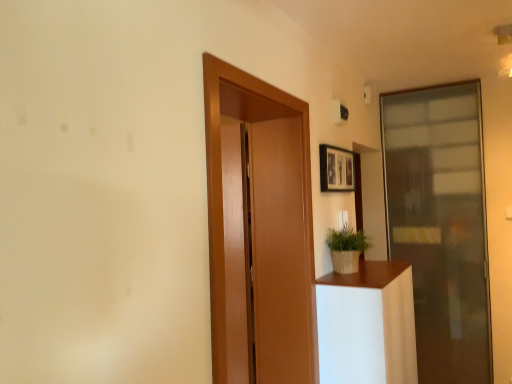
Consider the image. How much space does transparent glass door at right, marked as the 1th door in a right-to-left arrangement, occupy vertically?

transparent glass door at right, marked as the 1th door in a right-to-left arrangement, is 7.76 feet tall.

Where is `white matte plant pot at right`? This screenshot has width=512, height=384. white matte plant pot at right is located at coordinates (367, 325).

You are a GUI agent. You are given a task and a screenshot of the screen. Output one action in this format:
    pyautogui.click(x=<x>, y=<y>)
    Task: Click on the wooden framed picture at upper right
    Image resolution: width=512 pixels, height=384 pixels.
    Given the screenshot: What is the action you would take?
    pyautogui.click(x=336, y=169)

Find the location of a particular element. wooden door at center, the second door from the back is located at coordinates (265, 225).

From a real-world perspective, which object rests below the other?

white matte plant pot at right is physically lower.

Which of these two, green woven basket at right or white matte plant pot at right, is smaller?

green woven basket at right is smaller.

Is green woven basket at right in front of white matte plant pot at right?

No, green woven basket at right is behind white matte plant pot at right.

Is point (291, 125) behind point (424, 244)?

No, (291, 125) is closer to viewer.

From a real-world perspective, who is located lower, wooden door at center, which appears as the 1th door when viewed from the left, or transparent glass door at right, which is the first door from back to front?

transparent glass door at right, which is the first door from back to front.

How far apart are wooden door at center, the second door from the back, and transparent glass door at right, the 2th door positioned from the left?

The distance of wooden door at center, the second door from the back, from transparent glass door at right, the 2th door positioned from the left, is 1.78 meters.

Is white matte plant pot at right turned away from wooden door at center, arranged as the second door when viewed from the right?

No.

Is point (371, 381) less distant than point (216, 326)?

No, (371, 381) is behind (216, 326).

From the image's perspective, is white matte plant pot at right below wooden door at center, the 1th door from the front?

Yes, from the image's perspective, white matte plant pot at right is beneath wooden door at center, the 1th door from the front.

The width and height of the screenshot is (512, 384). Identify the location of picture frame that appears behind the wooden door at center, the 1th door from the front. click(x=336, y=169).

Relative to wooden door at center, which appears as the 1th door when viewed from the left, is wooden framed picture at upper right in front or behind?

Clearly, wooden framed picture at upper right is behind wooden door at center, which appears as the 1th door when viewed from the left.

From the picture: Is wooden framed picture at upper right placed right next to wooden door at center, the second door from the back?

wooden framed picture at upper right is not next to wooden door at center, the second door from the back, and they're not touching.

Is wooden framed picture at upper right looking in the opposite direction of wooden door at center, arranged as the second door when viewed from the right?

No, wooden framed picture at upper right is not facing away from wooden door at center, arranged as the second door when viewed from the right.

Is point (350, 184) farther from camera compared to point (472, 85)?

No.

Between wooden framed picture at upper right and transparent glass door at right, the 2th door positioned from the left, which one has less height?

Standing shorter between the two is wooden framed picture at upper right.

Visually, is wooden framed picture at upper right positioned to the left or to the right of transparent glass door at right, the 2th door positioned from the left?

wooden framed picture at upper right is to the left of transparent glass door at right, the 2th door positioned from the left.

How different are the orientations of wooden framed picture at upper right and transparent glass door at right, which is the second door from front to back, in degrees?

90.1 degrees separate the facing orientations of wooden framed picture at upper right and transparent glass door at right, which is the second door from front to back.

Which is in front, wooden framed picture at upper right or white matte plant pot at right?

white matte plant pot at right is in front.

Is wooden framed picture at upper right looking in the opposite direction of white matte plant pot at right?

No, wooden framed picture at upper right's orientation is not away from white matte plant pot at right.

Can you confirm if wooden framed picture at upper right is positioned to the left of white matte plant pot at right?

Yes, wooden framed picture at upper right is to the left of white matte plant pot at right.

Is wooden door at center, arranged as the second door when viewed from the right, at the back of transparent glass door at right, which is the second door from front to back?

No, transparent glass door at right, which is the second door from front to back, is not facing away from wooden door at center, arranged as the second door when viewed from the right.

The width and height of the screenshot is (512, 384). I want to click on door in front of the transparent glass door at right, the 2th door positioned from the left, so click(x=265, y=225).

Is transparent glass door at right, which is the first door from back to front, to the left of wooden door at center, the second door from the back, from the viewer's perspective?

Incorrect, transparent glass door at right, which is the first door from back to front, is not on the left side of wooden door at center, the second door from the back.

Looking at this image, is transparent glass door at right, the 2th door positioned from the left, placed right next to wooden door at center, the second door from the back?

transparent glass door at right, the 2th door positioned from the left, is not next to wooden door at center, the second door from the back, and they're not touching.

This screenshot has width=512, height=384. I want to click on houseplant above the white matte plant pot at right (from the image's perspective), so click(346, 249).

Identify the location of door on the left of transparent glass door at right, which is the first door from back to front. The height and width of the screenshot is (384, 512). (265, 225).

Considering their positions, is wooden framed picture at upper right positioned further to white matte plant pot at right than transparent glass door at right, marked as the 1th door in a right-to-left arrangement?

Among the two, transparent glass door at right, marked as the 1th door in a right-to-left arrangement, is located further to white matte plant pot at right.

Based on their spatial positions, is green woven basket at right or wooden door at center, the 1th door from the front, further from transparent glass door at right, marked as the 1th door in a right-to-left arrangement?

The object further to transparent glass door at right, marked as the 1th door in a right-to-left arrangement, is wooden door at center, the 1th door from the front.

Looking at the image, which one is located further to transparent glass door at right, marked as the 1th door in a right-to-left arrangement, wooden door at center, arranged as the second door when viewed from the right, or green woven basket at right?

wooden door at center, arranged as the second door when viewed from the right, is positioned further to the anchor transparent glass door at right, marked as the 1th door in a right-to-left arrangement.

Based on their spatial positions, is wooden door at center, the second door from the back, or transparent glass door at right, which is the second door from front to back, closer to white matte plant pot at right?

Among the two, wooden door at center, the second door from the back, is located nearer to white matte plant pot at right.

Estimate the real-world distances between objects in this image. Which object is closer to white matte plant pot at right, wooden framed picture at upper right or wooden door at center, which appears as the 1th door when viewed from the left?

The object closer to white matte plant pot at right is wooden door at center, which appears as the 1th door when viewed from the left.

Based on the photo, when comparing their distances from wooden door at center, the second door from the back, does transparent glass door at right, which is the second door from front to back, or white matte plant pot at right seem further?

Among the two, transparent glass door at right, which is the second door from front to back, is located further to wooden door at center, the second door from the back.

Based on their spatial positions, is transparent glass door at right, the 2th door positioned from the left, or wooden framed picture at upper right closer to white matte plant pot at right?

The object closer to white matte plant pot at right is wooden framed picture at upper right.

Considering their positions, is white matte plant pot at right positioned further to green woven basket at right than wooden framed picture at upper right?

wooden framed picture at upper right is further to green woven basket at right.

At what (x,y) coordinates should I click in order to perform the action: click on picture frame between white matte plant pot at right and transparent glass door at right, the 2th door positioned from the left, from front to back. Please return your answer as a coordinate pair (x, y). The width and height of the screenshot is (512, 384). Looking at the image, I should click on (336, 169).

Where is `houseplant situated between wooden framed picture at upper right and transparent glass door at right, the 2th door positioned from the left, from left to right`? houseplant situated between wooden framed picture at upper right and transparent glass door at right, the 2th door positioned from the left, from left to right is located at coordinates (346, 249).

Where is `houseplant positioned between wooden door at center, arranged as the second door when viewed from the right, and wooden framed picture at upper right from near to far`? The height and width of the screenshot is (384, 512). houseplant positioned between wooden door at center, arranged as the second door when viewed from the right, and wooden framed picture at upper right from near to far is located at coordinates (346, 249).

In order to click on furniture between wooden door at center, the second door from the back, and transparent glass door at right, the 2th door positioned from the left, in the front-back direction in this screenshot , I will do `click(367, 325)`.